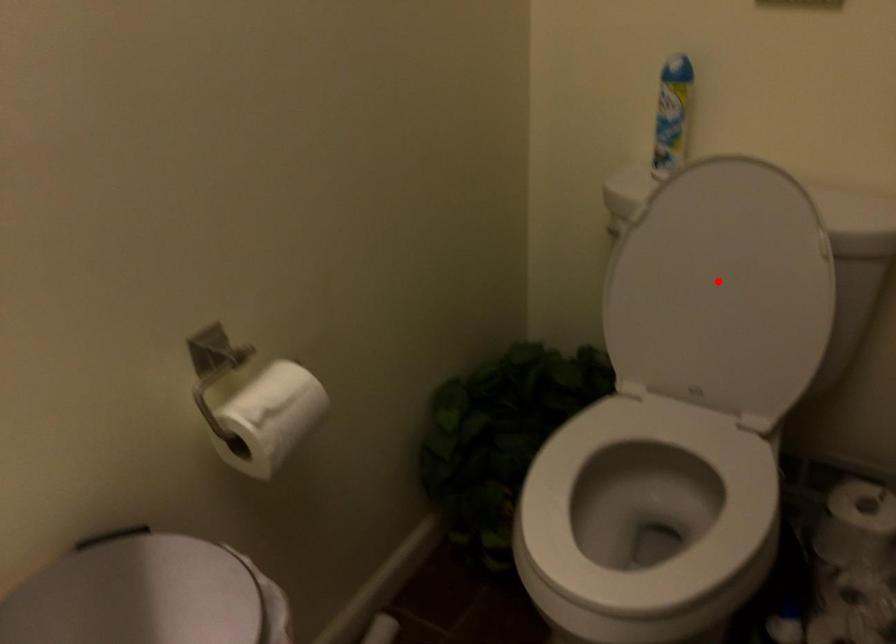
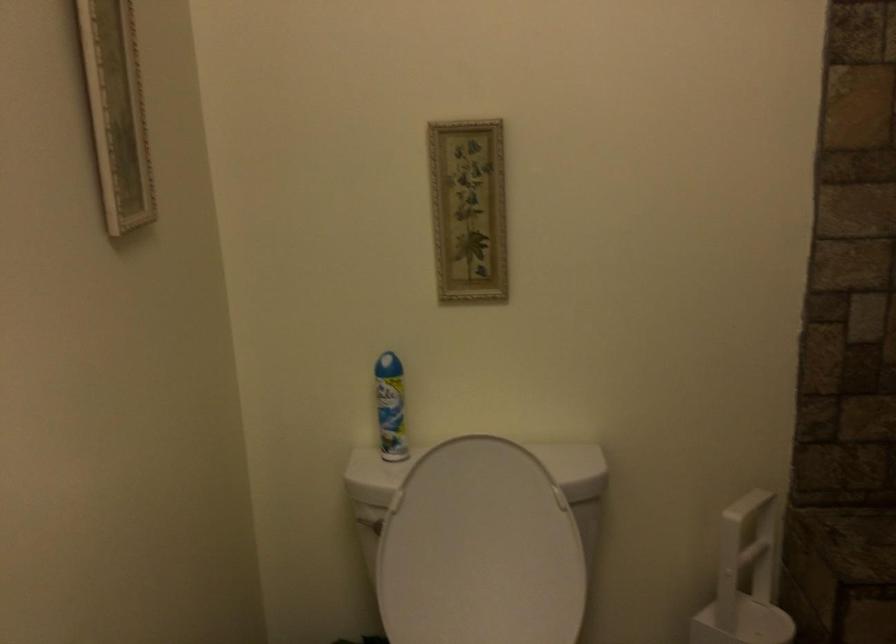
In the second image, find the point that corresponds to the highlighted location in the first image.

(479, 550)